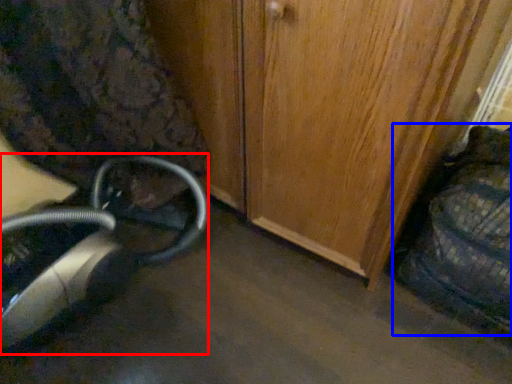
Question: Among these objects, which one is nearest to the camera, equipment (highlighted by a red box) or swivel chair (highlighted by a blue box)?

Choices:
 (A) equipment
 (B) swivel chair

Answer: (B)